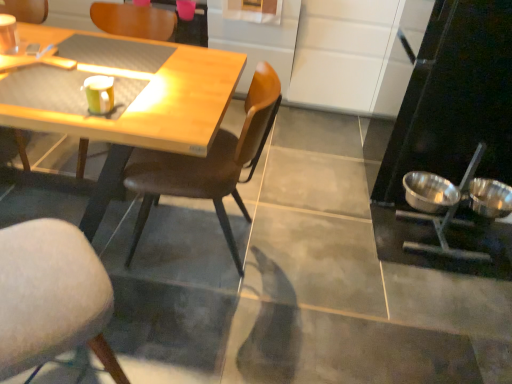
Question: Does wooden chair at center, arranged as the 2th chair when viewed from the left, have a greater width compared to matte yellow cup at upper left, arranged as the first coffee cup when ordered from the bottom?

Choices:
 (A) no
 (B) yes

Answer: (B)

Question: From a real-world perspective, is wooden chair at center, the 3th chair in the right-to-left sequence, below matte yellow cup at upper left, the second coffee cup positioned from the back?

Choices:
 (A) yes
 (B) no

Answer: (A)

Question: Is wooden chair at center, arranged as the 2th chair when viewed from the left, positioned behind matte yellow cup at upper left, arranged as the first coffee cup when ordered from the bottom?

Choices:
 (A) yes
 (B) no

Answer: (A)

Question: Does wooden chair at center, arranged as the 2th chair when viewed from the left, lie in front of matte yellow cup at upper left, the second coffee cup positioned from the back?

Choices:
 (A) no
 (B) yes

Answer: (A)

Question: Considering the relative sizes of wooden chair at center, arranged as the 2th chair when viewed from the left, and matte yellow cup at upper left, arranged as the first coffee cup when ordered from the bottom, in the image provided, is wooden chair at center, arranged as the 2th chair when viewed from the left, thinner than matte yellow cup at upper left, arranged as the first coffee cup when ordered from the bottom,?

Choices:
 (A) no
 (B) yes

Answer: (A)

Question: Is wooden chair at center, the 3th chair in the right-to-left sequence, outside of matte yellow cup at upper left, arranged as the first coffee cup when ordered from the bottom?

Choices:
 (A) yes
 (B) no

Answer: (A)

Question: Is wooden chair at center, the 3th chair in the right-to-left sequence, surrounded by matte yellow cup at upper left, the 2th coffee cup viewed from the top?

Choices:
 (A) no
 (B) yes

Answer: (A)

Question: Is the depth of matte yellow cup at upper left, the 2th coffee cup viewed from the top, less than that of wooden chair at center, arranged as the 2th chair when viewed from the left?

Choices:
 (A) yes
 (B) no

Answer: (A)

Question: Is matte yellow cup at upper left, the second coffee cup positioned from the back, far away from wooden chair at center, arranged as the 2th chair when viewed from the left?

Choices:
 (A) no
 (B) yes

Answer: (B)

Question: Is matte yellow cup at upper left, the 1th coffee cup when ordered from front to back, behind wooden chair at center, arranged as the 2th chair when viewed from the left?

Choices:
 (A) yes
 (B) no

Answer: (B)

Question: Is matte yellow cup at upper left, the 1th coffee cup when ordered from front to back, outside of wooden chair at center, the 3th chair in the right-to-left sequence?

Choices:
 (A) yes
 (B) no

Answer: (A)

Question: Is matte yellow cup at upper left, the 1th coffee cup when ordered from front to back, next to wooden chair at center, the 3th chair in the right-to-left sequence?

Choices:
 (A) no
 (B) yes

Answer: (A)

Question: From the image's perspective, would you say soft gray cushioned chair at lower left, which is the third chair in left-to-right order, is shown under brown leather chair at center, positioned as the 1th chair in right-to-left order?

Choices:
 (A) yes
 (B) no

Answer: (A)